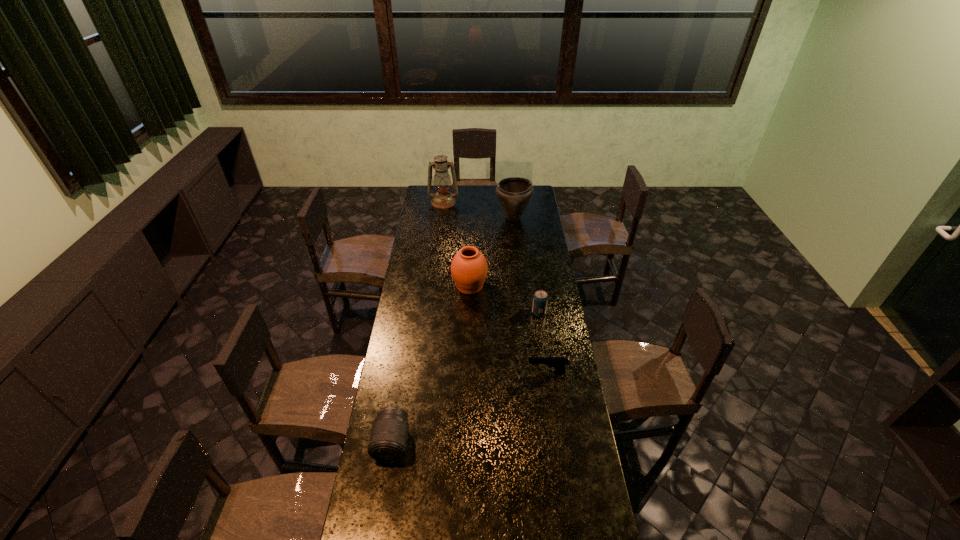
What are the coordinates of `blank region between the pistol and the fourth farthest object` in the screenshot? It's located at (543, 342).

In order to click on free space between the nearest object and the farther urn in this screenshot , I will do click(x=452, y=330).

In order to click on empty location between the oil lamp and the left urn in this screenshot , I will do `click(457, 244)`.

I want to click on empty location between the farther urn and the pop soda, so click(526, 265).

This screenshot has height=540, width=960. I want to click on empty location between the right urn and the oil lamp, so click(478, 210).

Locate an element on the screen. This screenshot has width=960, height=540. vacant area that lies between the shortest object and the pop soda is located at coordinates (543, 342).

You are a GUI agent. You are given a task and a screenshot of the screen. Output one action in this format:
    pyautogui.click(x=<x>, y=<y>)
    Task: Click on the object that can be found as the fourth closest to the oil lamp
    Image resolution: width=960 pixels, height=540 pixels.
    Given the screenshot: What is the action you would take?
    pyautogui.click(x=559, y=363)

I want to click on object identified as the second closest to the oil lamp, so click(x=469, y=268).

Locate an element on the screen. vacant region that satisfies the following two spatial constraints: 1. on the front side of the tallest object; 2. on the left side of the pop soda is located at coordinates (430, 313).

Image resolution: width=960 pixels, height=540 pixels. In order to click on vacant region that satisfies the following two spatial constraints: 1. on the front side of the right urn; 2. on the right side of the tallest object in this screenshot , I will do `click(442, 218)`.